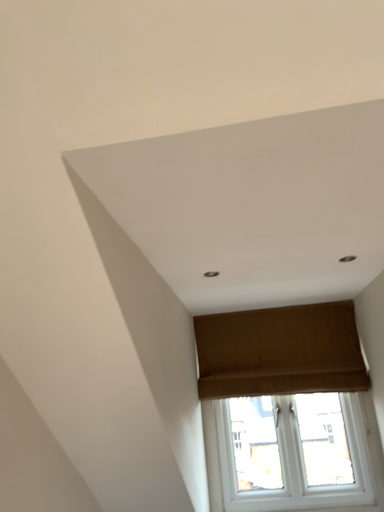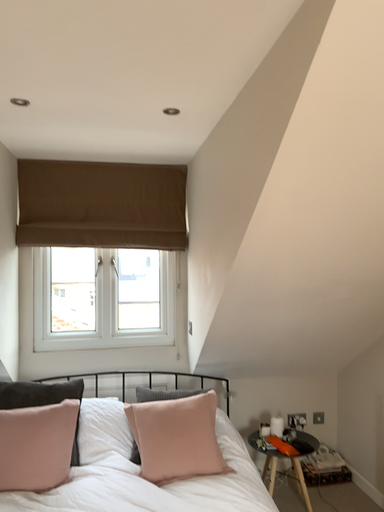
Question: How did the camera likely rotate when shooting the video?

Choices:
 (A) rotated left
 (B) rotated right

Answer: (B)